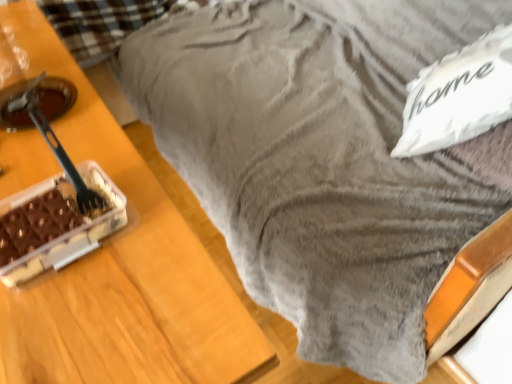
The height and width of the screenshot is (384, 512). I want to click on free spot to the right of black plastic fork at left, so click(x=152, y=206).